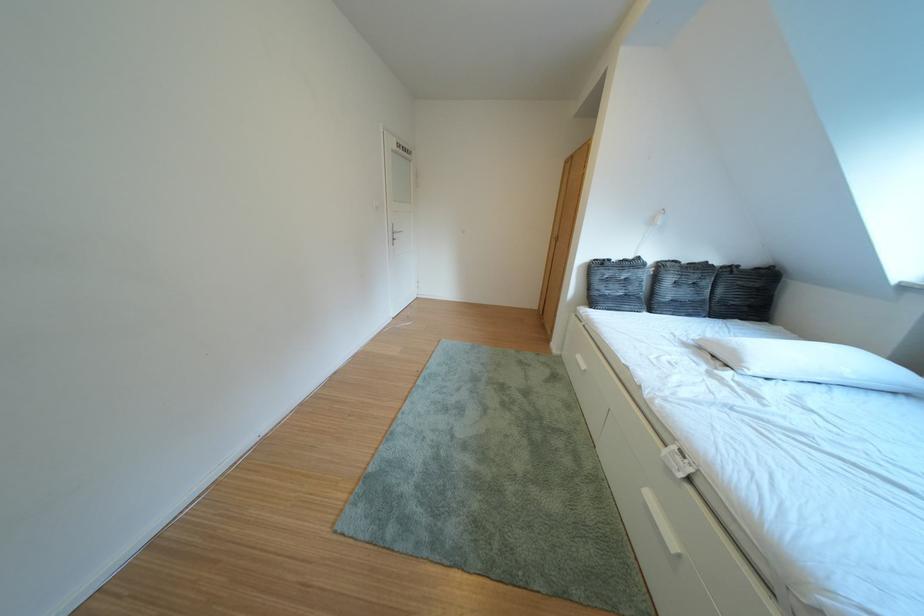
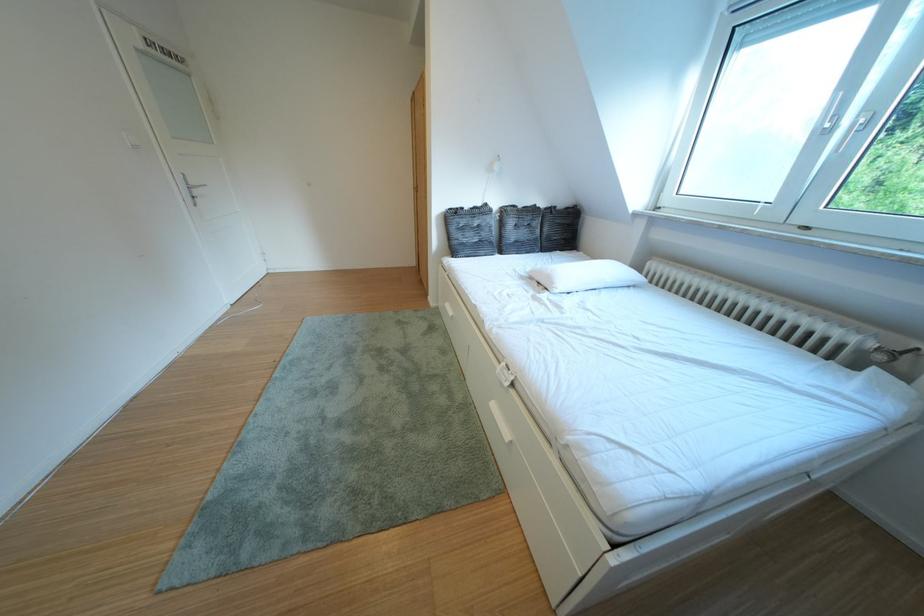
Find the pixel in the second image that matches [610,299] in the first image.

(468, 246)